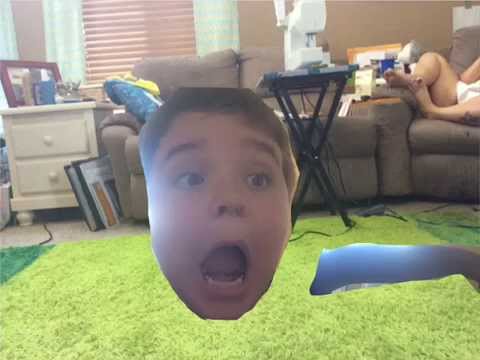
Identify the location of drawer. (36, 173), (25, 141).